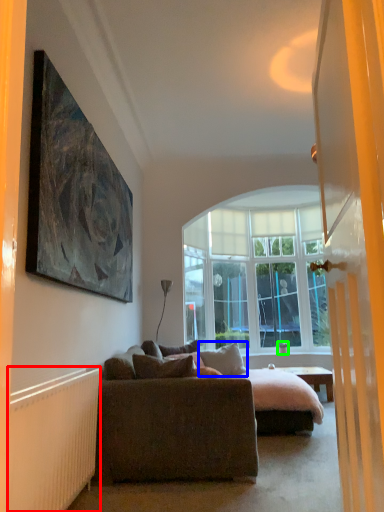
Question: Which object is the closest to the radiator (highlighted by a red box)? Choose among these: pillow (highlighted by a blue box) or houseplant (highlighted by a green box).

Choices:
 (A) pillow
 (B) houseplant

Answer: (A)